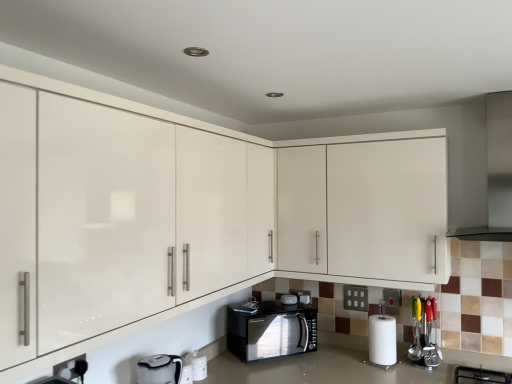
Question: In which direction should I rotate to look at matte white cabinets at center, which ranks as the 1th cabinetry in front-to-back order?

Choices:
 (A) left
 (B) right

Answer: (A)

Question: Is black matte gas stove at lower right thinner than black glossy microwave at lower center, the 3th appliance from the front?

Choices:
 (A) yes
 (B) no

Answer: (B)

Question: Does black matte gas stove at lower right have a greater height compared to black glossy microwave at lower center, the 2th appliance in the left-to-right sequence?

Choices:
 (A) yes
 (B) no

Answer: (A)

Question: Considering the relative sizes of black matte gas stove at lower right and black glossy microwave at lower center, the 3th appliance from the front, in the image provided, is black matte gas stove at lower right wider than black glossy microwave at lower center, the 3th appliance from the front,?

Choices:
 (A) yes
 (B) no

Answer: (A)

Question: Is black matte gas stove at lower right touching black glossy microwave at lower center, the 2th appliance in the left-to-right sequence?

Choices:
 (A) no
 (B) yes

Answer: (A)

Question: Is black matte gas stove at lower right shorter than black glossy microwave at lower center, acting as the third appliance starting from the right?

Choices:
 (A) yes
 (B) no

Answer: (B)

Question: From a real-world perspective, is black matte gas stove at lower right beneath black glossy microwave at lower center, the 2th appliance in the left-to-right sequence?

Choices:
 (A) no
 (B) yes

Answer: (B)

Question: From a real-world perspective, does matte white cabinets at center, which ranks as the 1th cabinetry in front-to-back order, stand above black glossy microwave at lower center, acting as the third appliance starting from the right?

Choices:
 (A) yes
 (B) no

Answer: (A)

Question: Does matte white cabinets at center, which ranks as the 1th cabinetry in front-to-back order, have a lesser height compared to black glossy microwave at lower center, the 2th appliance in the left-to-right sequence?

Choices:
 (A) yes
 (B) no

Answer: (B)

Question: Considering the relative positions of matte white cabinets at center, marked as the 2th cabinetry in a back-to-front arrangement, and black glossy microwave at lower center, the 3th appliance from the front, in the image provided, is matte white cabinets at center, marked as the 2th cabinetry in a back-to-front arrangement, to the right of black glossy microwave at lower center, the 3th appliance from the front, from the viewer's perspective?

Choices:
 (A) yes
 (B) no

Answer: (B)

Question: Is matte white cabinets at center, marked as the 2th cabinetry in a back-to-front arrangement, closer to the viewer compared to black glossy microwave at lower center, the 3th appliance from the front?

Choices:
 (A) no
 (B) yes

Answer: (B)

Question: Is matte white cabinets at center, which ranks as the 1th cabinetry in front-to-back order, oriented away from black glossy microwave at lower center, the 3th appliance from the front?

Choices:
 (A) no
 (B) yes

Answer: (A)

Question: Is matte white cabinets at center, which ranks as the 1th cabinetry in front-to-back order, next to black glossy microwave at lower center, the 2th appliance in the left-to-right sequence, and touching it?

Choices:
 (A) no
 (B) yes

Answer: (A)

Question: Can you see white matte paper towel at lower right touching matte white cabinets at center, which ranks as the 1th cabinetry in front-to-back order?

Choices:
 (A) no
 (B) yes

Answer: (A)